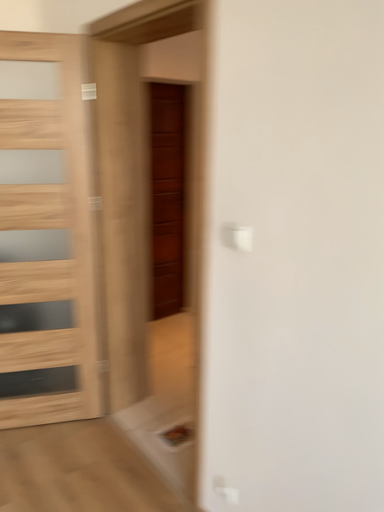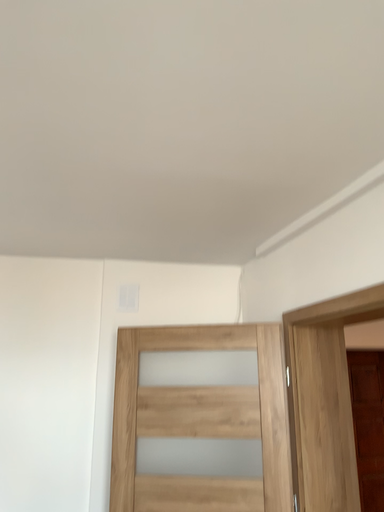
Question: Which way did the camera rotate in the video?

Choices:
 (A) rotated upward
 (B) rotated downward

Answer: (A)